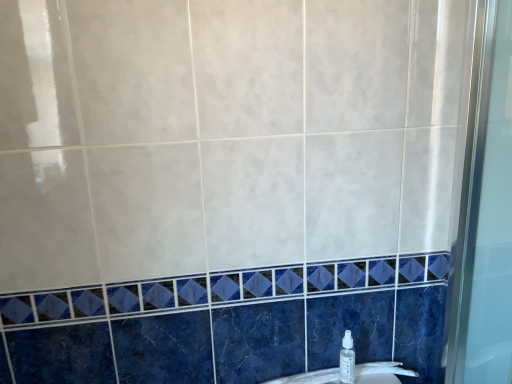
Question: Is point [x=351, y=359] closer or farther from the camera than point [x=377, y=372]?

Choices:
 (A) closer
 (B) farther

Answer: (A)

Question: From a real-world perspective, is clear plastic spray bottle at lower right positioned above or below white glossy sink at lower center?

Choices:
 (A) below
 (B) above

Answer: (B)

Question: From the image's perspective, relative to white glossy sink at lower center, is clear plastic spray bottle at lower right above or below?

Choices:
 (A) above
 (B) below

Answer: (A)

Question: From the image's perspective, is white glossy sink at lower center located above or below clear plastic spray bottle at lower right?

Choices:
 (A) above
 (B) below

Answer: (B)

Question: In terms of size, does white glossy sink at lower center appear bigger or smaller than clear plastic spray bottle at lower right?

Choices:
 (A) big
 (B) small

Answer: (A)

Question: Relative to clear plastic spray bottle at lower right, is white glossy sink at lower center in front or behind?

Choices:
 (A) front
 (B) behind

Answer: (B)

Question: From a real-world perspective, is white glossy sink at lower center physically located above or below clear plastic spray bottle at lower right?

Choices:
 (A) above
 (B) below

Answer: (B)